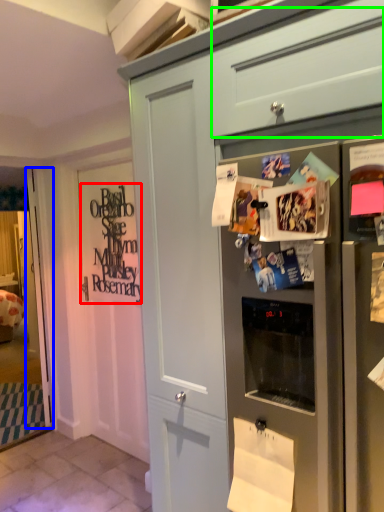
Question: Which object is positioned farthest from signature (highlighted by a red box)? Select from door (highlighted by a blue box) and drawer (highlighted by a green box).

Choices:
 (A) door
 (B) drawer

Answer: (B)